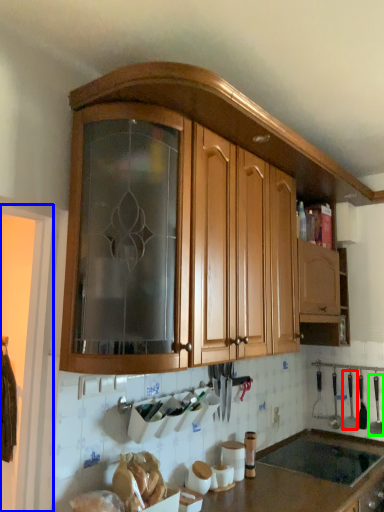
Question: Considering the real-world distances, which object is closest to silverware (highlighted by a red box)? screen door (highlighted by a blue box) or silverware (highlighted by a green box).

Choices:
 (A) screen door
 (B) silverware

Answer: (B)